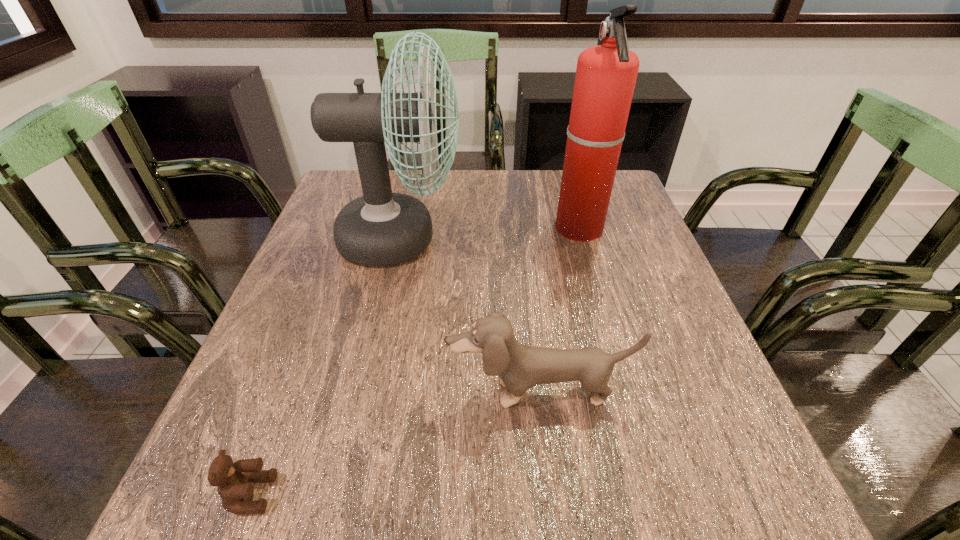
This screenshot has height=540, width=960. I want to click on fire extinguisher, so click(606, 74).

Find the location of a particular element. This screenshot has width=960, height=540. fan is located at coordinates (381, 228).

What are the coordinates of `the third farthest object` in the screenshot? It's located at (519, 367).

Locate an element on the screen. puppy is located at coordinates (519, 367).

The height and width of the screenshot is (540, 960). I want to click on teddy bear, so click(235, 480).

The width and height of the screenshot is (960, 540). Find the location of `the nearest object`. the nearest object is located at coordinates (235, 480).

Identify the location of vacant region located with the nozzle and gauge on the fire extinguisher. The width and height of the screenshot is (960, 540). (450, 229).

The width and height of the screenshot is (960, 540). In order to click on vacant space located 0.050m with the nozzle and gauge on the fire extinguisher in this screenshot , I will do `click(536, 229)`.

Locate an element on the screen. This screenshot has height=540, width=960. blank area located 0.080m with the nozzle and gauge on the fire extinguisher is located at coordinates (524, 229).

You are a GUI agent. You are given a task and a screenshot of the screen. Output one action in this format:
    pyautogui.click(x=<x>, y=<y>)
    Task: Click on the free space located in front of the fan where the airflow is directed
    
    Given the screenshot: What is the action you would take?
    pyautogui.click(x=487, y=239)